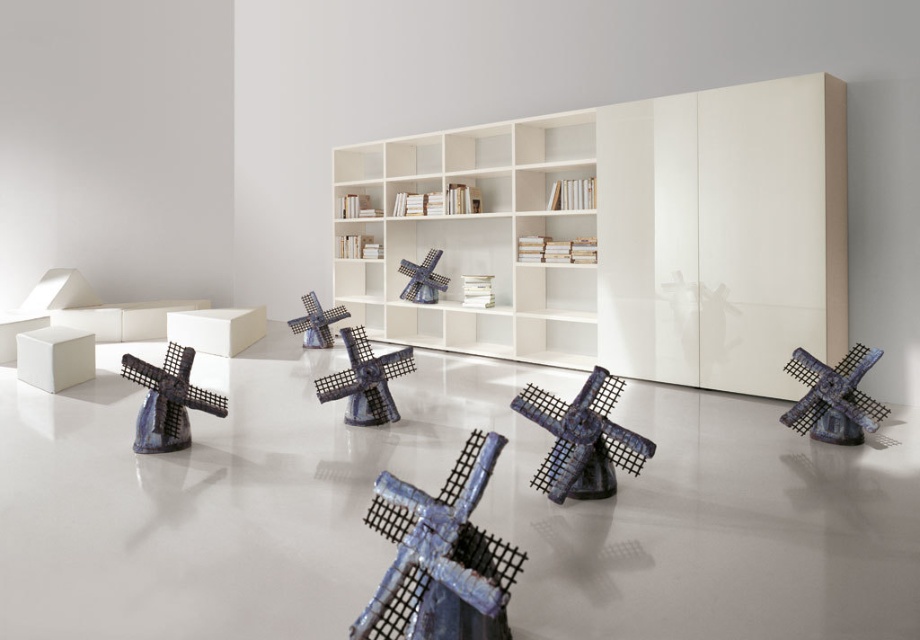
You are an interior designer assessing the placement of the shiny blue windmill at center and the blue ceramic windmill at center. Which one has a greater height?

The blue ceramic windmill at center is taller than the shiny blue windmill at center, so the blue ceramic windmill at center has a greater height.

You are a visitor standing in the room and want to take a photo of the blue metallic windmill at center without including the white glossy bookshelf at center in the frame. Which direction should you move to achieve this?

The blue metallic windmill at center is positioned on the right side of the white glossy bookshelf at center. To avoid including the bookshelf in the photo, you should move to the right side of the windmill.

You are a delivery person who needs to place a new windmill sculpture on the floor without overlapping any existing ones. Given that the shiny blue windmill at center and the blue ceramic windmill at center are both on the floor, which one requires more space between them to avoid collision?

The shiny blue windmill at center requires more space between them to avoid collision because its width surpasses that of the blue ceramic windmill at center.